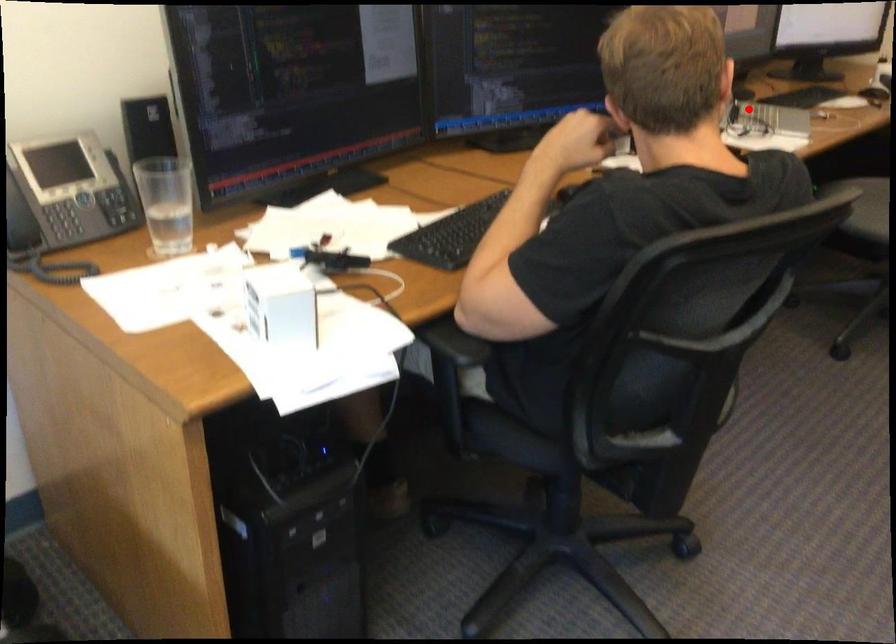
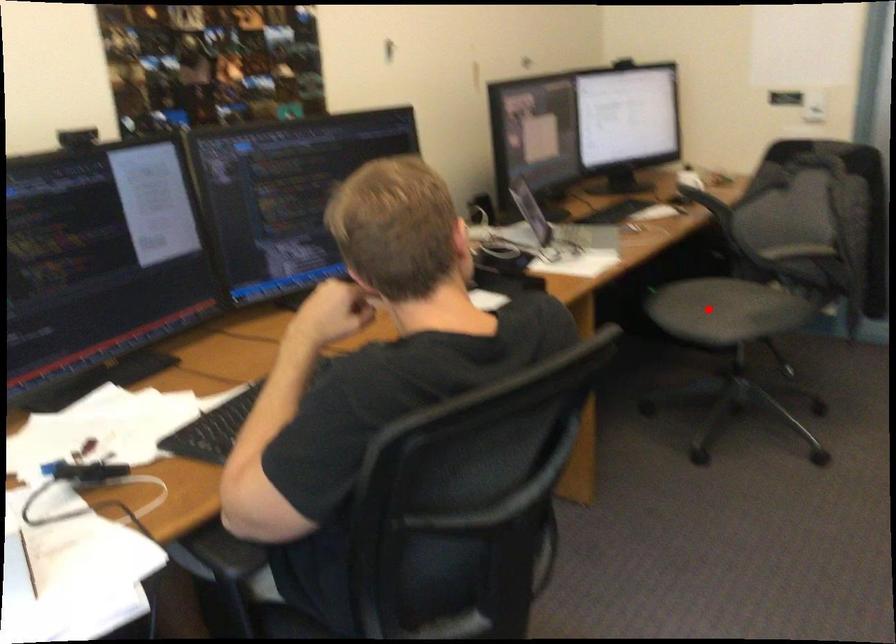
I am providing you with two images of the same scene from different viewpoints. A red point is marked on the first image and another point is marked on the second image. Is the red point in image1 aligned with the point shown in image2?

No